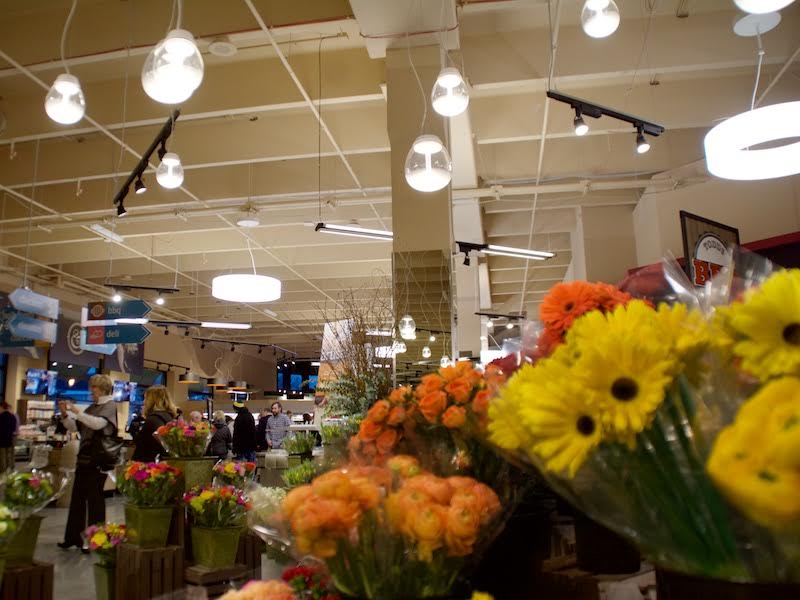
What are the coordinates of `lights` in the screenshot? It's located at coord(432,172), coord(452,87), coord(174,171), coord(66,106).